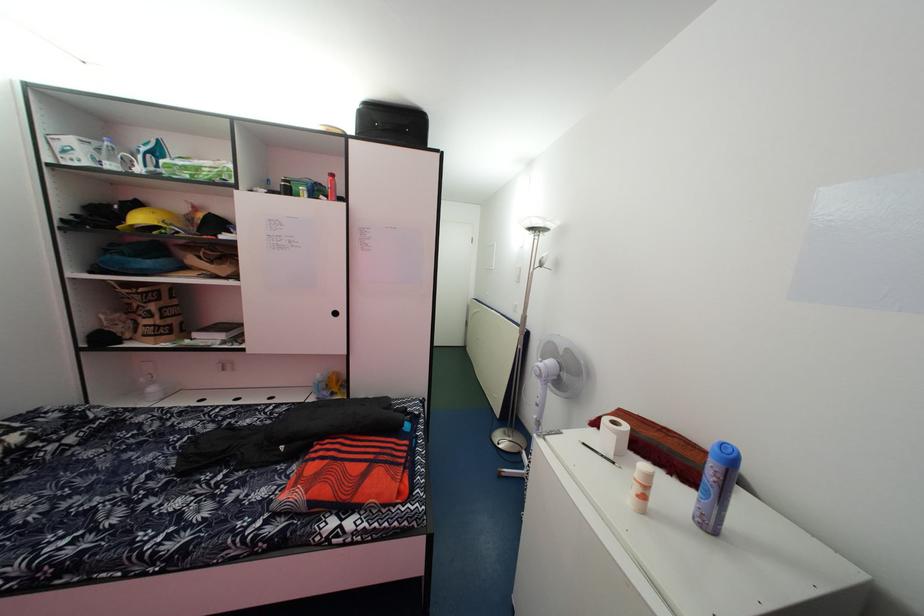
Identify the location of blue spray can. (715, 487).